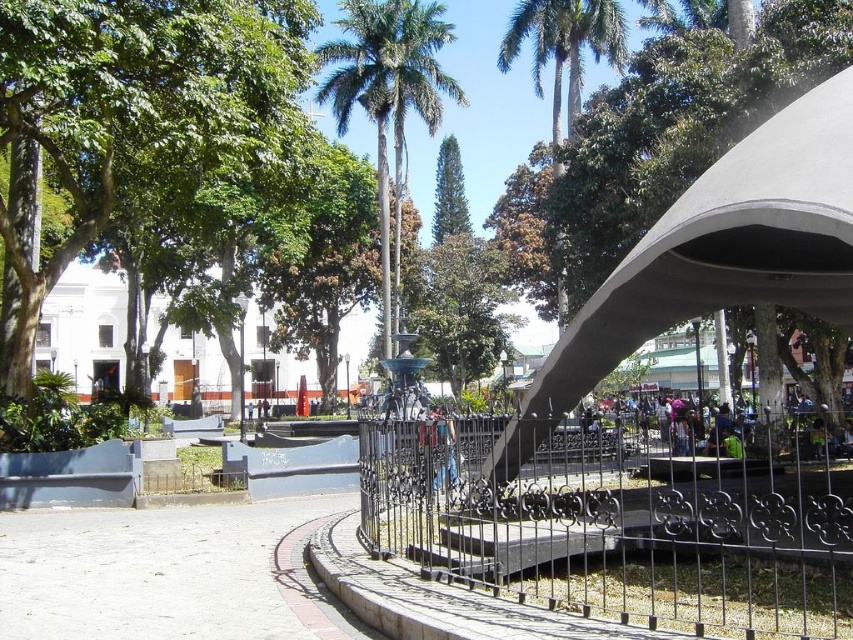
Question: Among these objects, which one is farthest from the camera?

Choices:
 (A) black wrought iron fence at center
 (B) metallic fence at center

Answer: (B)

Question: Can you confirm if black wrought iron fence at center is positioned to the right of green leafy palm tree at center?

Choices:
 (A) no
 (B) yes

Answer: (B)

Question: Where is black wrought iron fence at center located in relation to metallic fence at center in the image?

Choices:
 (A) above
 (B) below

Answer: (B)

Question: Which of the following is the closest to the observer?

Choices:
 (A) black wrought iron fence at center
 (B) green leafy palm tree at center
 (C) green leafy palm tree at upper center
 (D) metallic fence at center

Answer: (A)

Question: Which of the following is the farthest from the observer?

Choices:
 (A) black wrought iron fence at center
 (B) metallic fence at center

Answer: (B)

Question: Can you confirm if black wrought iron fence at center is thinner than green leafy palm tree at center?

Choices:
 (A) yes
 (B) no

Answer: (B)